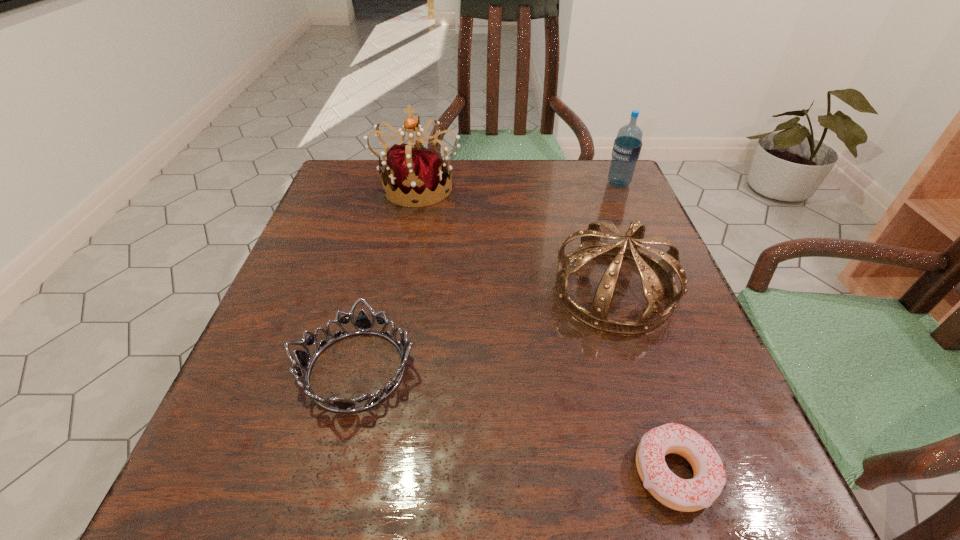
Where is `vacant space that is in between the rightmost tiara and the shortest object`? vacant space that is in between the rightmost tiara and the shortest object is located at coordinates (644, 381).

Locate an element on the screen. free space that is in between the water bottle and the shortest tiara is located at coordinates point(488,276).

You are a GUI agent. You are given a task and a screenshot of the screen. Output one action in this format:
    pyautogui.click(x=<x>, y=<y>)
    Task: Click on the free space between the doughnut and the second shortest tiara
    The height and width of the screenshot is (540, 960).
    Given the screenshot: What is the action you would take?
    pyautogui.click(x=644, y=381)

Find the location of `empty location between the third shortest object and the water bottle`. empty location between the third shortest object and the water bottle is located at coordinates (616, 237).

Locate an element on the screen. vacant space that is in between the second shortest object and the water bottle is located at coordinates (488, 276).

At what (x,y) coordinates should I click in order to perform the action: click on free point between the fourth tallest object and the water bottle. Please return your answer as a coordinate pair (x, y). This screenshot has height=540, width=960. Looking at the image, I should click on (488, 276).

You are a GUI agent. You are given a task and a screenshot of the screen. Output one action in this format:
    pyautogui.click(x=<x>, y=<y>)
    Task: Click on the free space between the fourth tallest object and the second shortest tiara
    
    Given the screenshot: What is the action you would take?
    pyautogui.click(x=485, y=330)

Identify the location of object that ranks as the closest to the water bottle. (651, 270).

Identify which object is located as the nearest to the second shortest object. Please provide its 2D coordinates. Your answer should be formatted as a tuple, i.e. [(x, y)], where the tuple contains the x and y coordinates of a point satisfying the conditions above.

[(651, 270)]

The image size is (960, 540). I want to click on tiara that is the closest one to the tallest tiara, so click(651, 270).